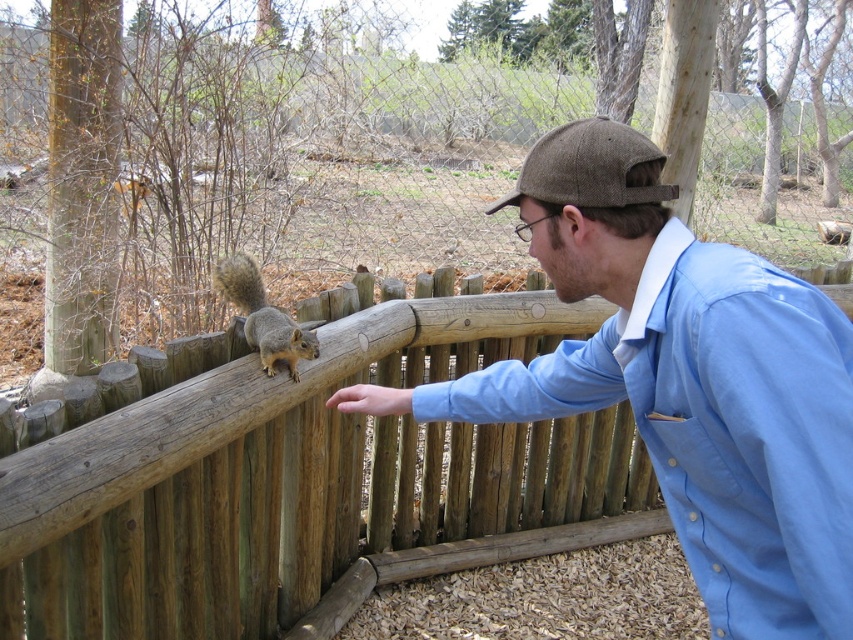
Is brown wooden fence at center to the left of blue cotton shirt at center from the viewer's perspective?

Yes, brown wooden fence at center is to the left of blue cotton shirt at center.

Does point (407, 424) come closer to viewer compared to point (558, 296)?

No, it is behind (558, 296).

Does point (259, 620) lie behind point (730, 413)?

Yes.

Locate an element on the screen. The width and height of the screenshot is (853, 640). brown wooden fence at center is located at coordinates (321, 520).

Consider the image. Who is higher up, brown wooden fence at center or gray fur squirrel at center?

gray fur squirrel at center is above.

Which is more to the left, brown wooden fence at center or gray fur squirrel at center?

From the viewer's perspective, gray fur squirrel at center appears more on the left side.

Who is more forward, [332,472] or [254,305]?

Point [254,305] is in front.

Locate an element on the screen. This screenshot has height=640, width=853. brown wooden fence at center is located at coordinates (321, 520).

Does brown wooden fence at center have a greater height compared to smooth skin hand at center?

Yes, brown wooden fence at center is taller than smooth skin hand at center.

Between point (346, 552) and point (378, 406), which one is positioned behind?

The point (346, 552) is behind.

Between point (273, 548) and point (347, 412), which one is positioned behind?

The point (273, 548) is more distant.

At what (x,y) coordinates should I click in order to perform the action: click on brown wooden fence at center. Please return your answer as a coordinate pair (x, y). Looking at the image, I should click on (321, 520).